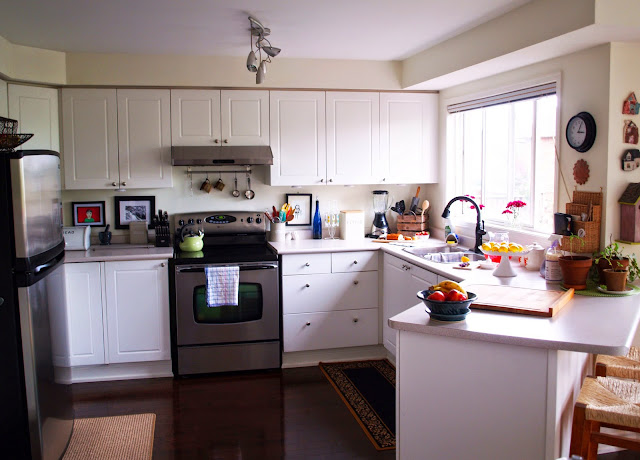
Identify the location of dark brown mat. (365, 388).